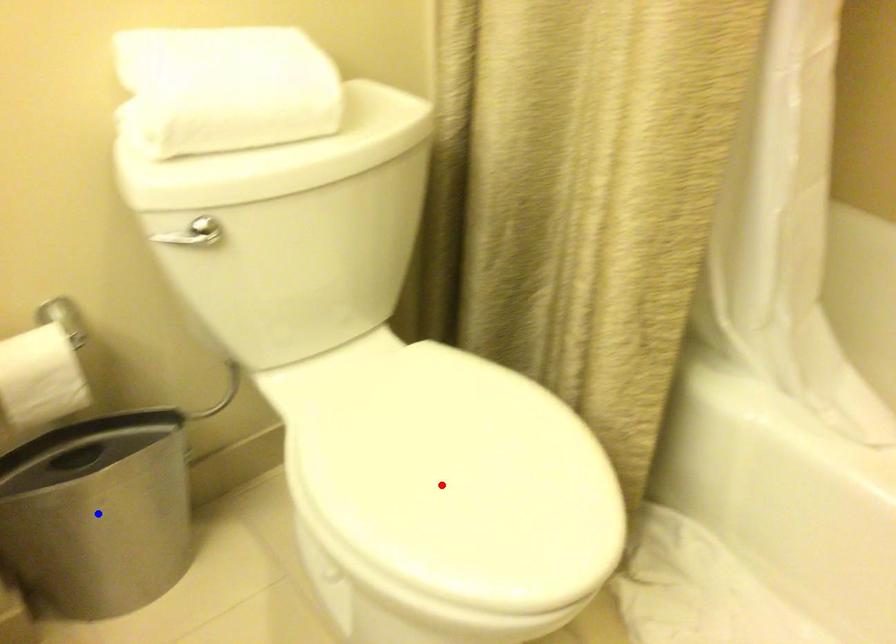
Question: In the image, two points are highlighted. Which point is nearer to the camera? Reply with the corresponding letter.

Choices:
 (A) blue point
 (B) red point

Answer: (B)